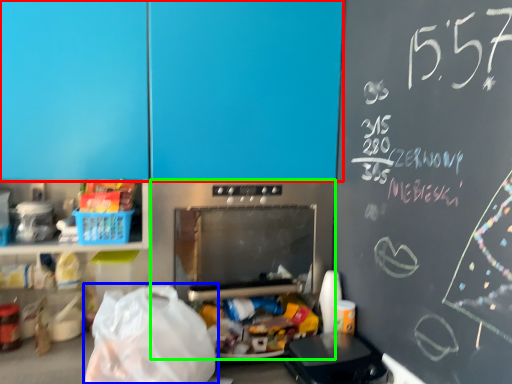
Question: Which object is positioned closest to leftover (highlighted by a red box)? Select from grocery bag (highlighted by a blue box) and appliance (highlighted by a green box).

Choices:
 (A) grocery bag
 (B) appliance

Answer: (B)